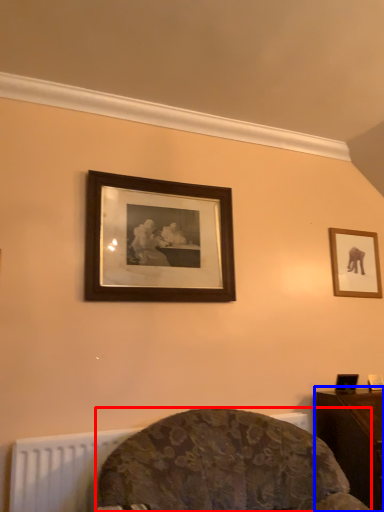
Question: Which object is further to the camera taking this photo, furniture (highlighted by a red box) or table (highlighted by a blue box)?

Choices:
 (A) furniture
 (B) table

Answer: (B)